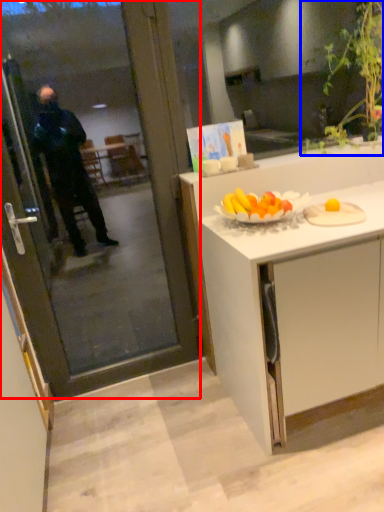
Question: Which of the following is the farthest to the observer, screen door (highlighted by a red box) or houseplant (highlighted by a blue box)?

Choices:
 (A) screen door
 (B) houseplant

Answer: (B)